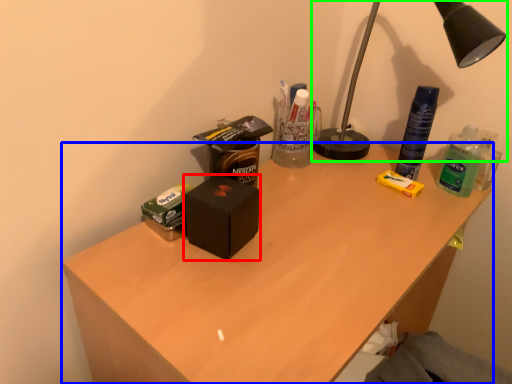
Question: Considering the real-world distances, which object is farthest from box (highlighted by a red box)? desk (highlighted by a blue box) or lamp (highlighted by a green box)?

Choices:
 (A) desk
 (B) lamp

Answer: (B)